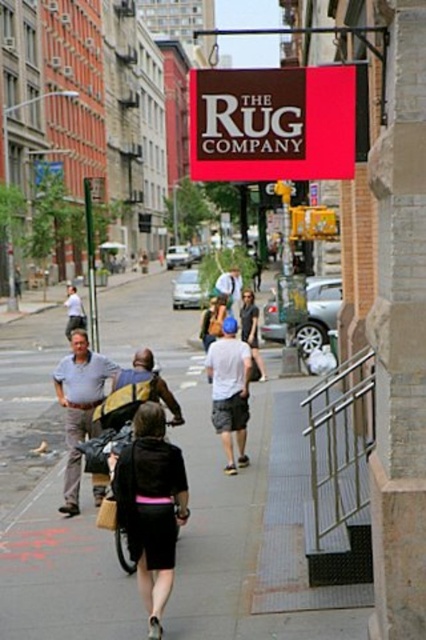
Can you confirm if gray concrete sidewalk at center is positioned below white cotton t-shirt at center?

Correct, gray concrete sidewalk at center is located below white cotton t-shirt at center.

Who is shorter, gray concrete sidewalk at center or white cotton t-shirt at center?

white cotton t-shirt at center is shorter.

Find the location of a particular element. gray concrete sidewalk at center is located at coordinates [x=235, y=496].

Can you confirm if black matte shorts at center is bigger than white cotton t-shirt at center?

Actually, black matte shorts at center might be smaller than white cotton t-shirt at center.

Identify the location of black matte shorts at center. (150, 506).

Does black matte shorts at center have a lesser height compared to light blue shirt at center?

No, black matte shorts at center is not shorter than light blue shirt at center.

Is black matte shorts at center above light blue shirt at center?

Actually, black matte shorts at center is below light blue shirt at center.

Is point (137, 474) positioned in front of point (78, 492)?

Yes, it is in front of point (78, 492).

Locate an element on the screen. The image size is (426, 640). black matte shorts at center is located at coordinates (150, 506).